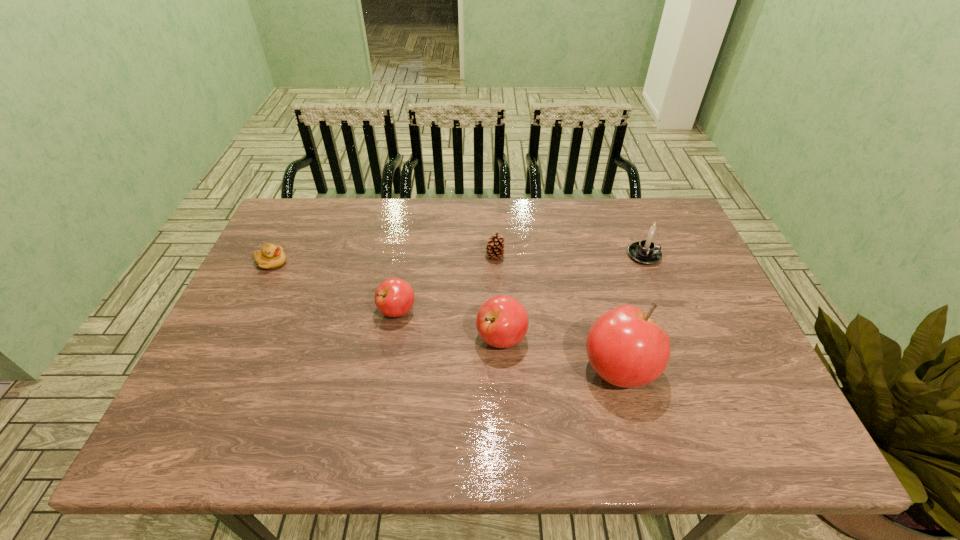
Find the location of `vacant area situated on the front of the second apple from left to right`. vacant area situated on the front of the second apple from left to right is located at coordinates pos(503,378).

Locate an element on the screen. free space located on the left of the second object from right to left is located at coordinates (426, 369).

The image size is (960, 540). I want to click on vacant space situated 0.140m on the front-facing side of the shortest object, so click(x=335, y=263).

Find the location of `vacant space located 0.100m with a handle on the side of the candle holder`. vacant space located 0.100m with a handle on the side of the candle holder is located at coordinates (694, 255).

Locate an element on the screen. vacant space positioned on the right of the pinecone is located at coordinates (535, 256).

The image size is (960, 540). I want to click on object that is at the far edge, so click(x=646, y=252).

Where is `object at the near edge`? The width and height of the screenshot is (960, 540). object at the near edge is located at coordinates (625, 347).

Locate an element on the screen. object situated at the left edge is located at coordinates (271, 256).

The width and height of the screenshot is (960, 540). In order to click on object situated at the right edge in this screenshot , I will do `click(646, 252)`.

This screenshot has width=960, height=540. I want to click on object positioned at the far right corner, so click(646, 252).